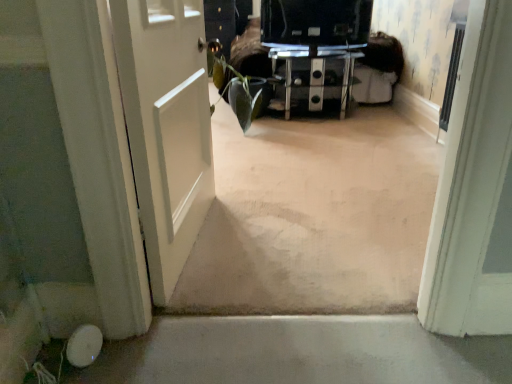
Question: From the image's perspective, is black glossy tv at center under black glass tv stand at center?

Choices:
 (A) no
 (B) yes

Answer: (A)

Question: Can you see black glossy tv at center touching black glass tv stand at center?

Choices:
 (A) no
 (B) yes

Answer: (A)

Question: Would you say black glossy tv at center is outside black glass tv stand at center?

Choices:
 (A) yes
 (B) no

Answer: (A)

Question: Does black glossy tv at center have a lesser width compared to black glass tv stand at center?

Choices:
 (A) no
 (B) yes

Answer: (B)

Question: Is black glossy tv at center taller than black glass tv stand at center?

Choices:
 (A) no
 (B) yes

Answer: (A)

Question: Considering the positions of white matte door at left and black glass tv stand at center in the image, is white matte door at left taller or shorter than black glass tv stand at center?

Choices:
 (A) short
 (B) tall

Answer: (B)

Question: Considering the positions of white matte door at left and black glass tv stand at center in the image, is white matte door at left wider or thinner than black glass tv stand at center?

Choices:
 (A) thin
 (B) wide

Answer: (A)

Question: From the image's perspective, relative to black glass tv stand at center, is white matte door at left above or below?

Choices:
 (A) above
 (B) below

Answer: (B)

Question: From a real-world perspective, is white matte door at left positioned above or below black glass tv stand at center?

Choices:
 (A) below
 (B) above

Answer: (B)

Question: From a real-world perspective, relative to black glossy tv at center, is black glass tv stand at center vertically above or below?

Choices:
 (A) above
 (B) below

Answer: (B)

Question: Is point (278, 51) positioned closer to the camera than point (273, 1)?

Choices:
 (A) closer
 (B) farther

Answer: (B)

Question: In the image, is black glass tv stand at center on the left side or the right side of black glossy tv at center?

Choices:
 (A) right
 (B) left

Answer: (A)

Question: From the image's perspective, is black glass tv stand at center located above or below black glossy tv at center?

Choices:
 (A) above
 (B) below

Answer: (B)

Question: In terms of width, does white matte door at left look wider or thinner when compared to black glossy tv at center?

Choices:
 (A) wide
 (B) thin

Answer: (B)

Question: Considering their positions, is white matte door at left located in front of or behind black glossy tv at center?

Choices:
 (A) behind
 (B) front

Answer: (B)